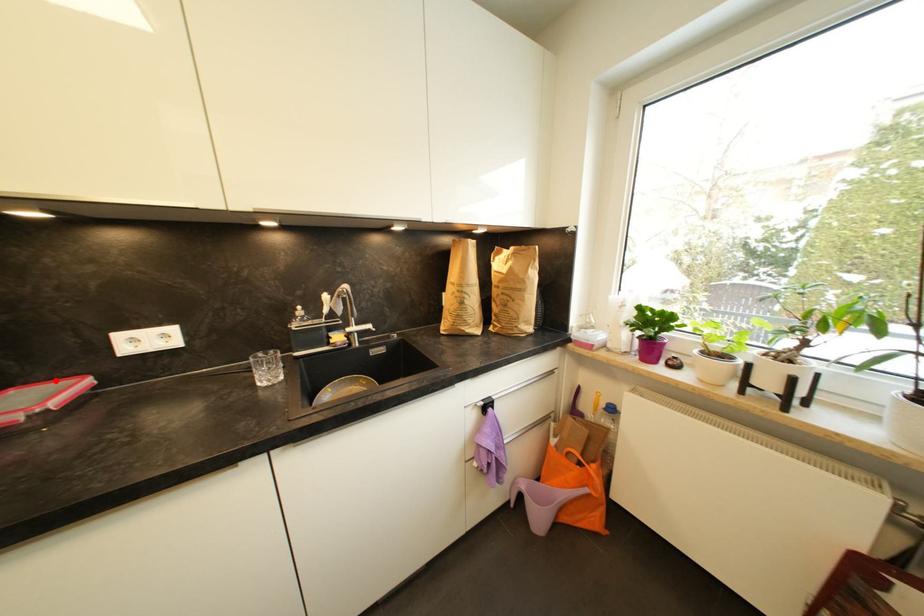
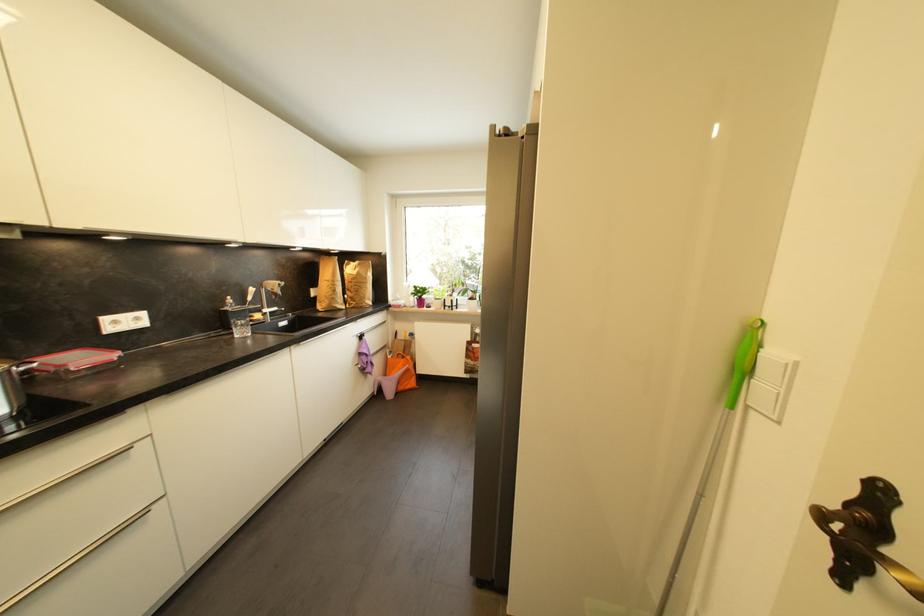
Locate, in the second image, the point that corresponds to the highlighted location in the first image.

(54, 355)